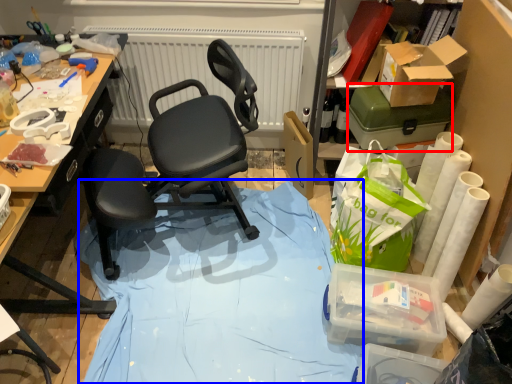
Question: Which object appears closest to the camera in this image, box (highlighted by a red box) or fabric (highlighted by a blue box)?

Choices:
 (A) box
 (B) fabric

Answer: (B)